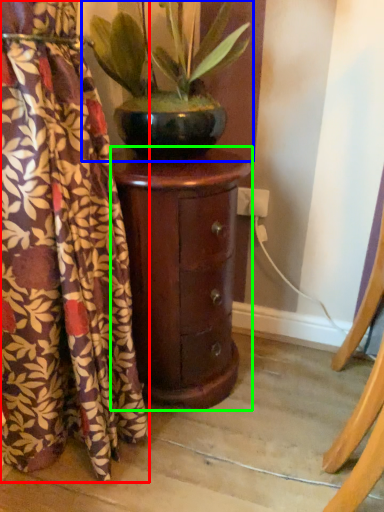
Question: Based on their relative distances, which object is farther from curtain (highlighted by a red box)? Choose from houseplant (highlighted by a blue box) and furniture (highlighted by a green box).

Choices:
 (A) houseplant
 (B) furniture

Answer: (A)